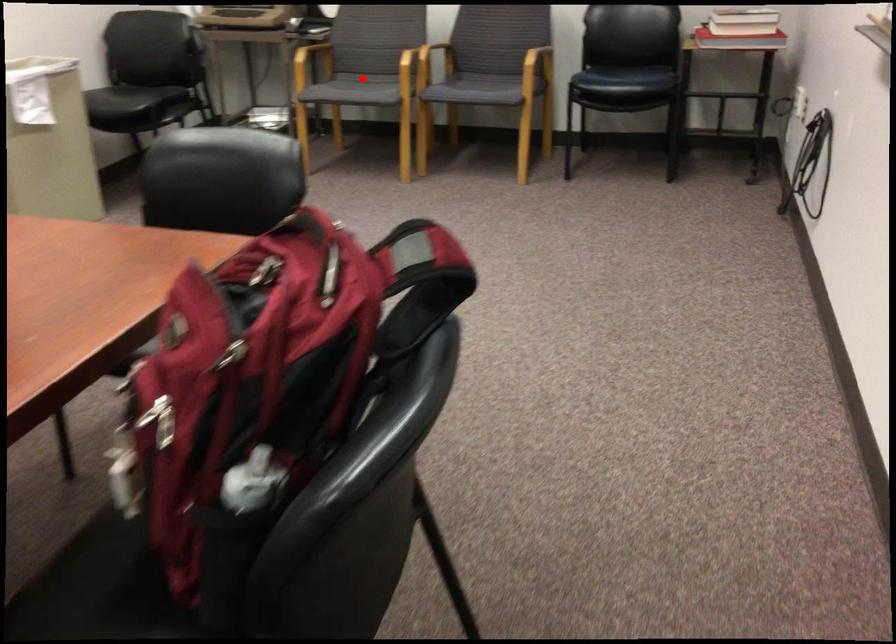
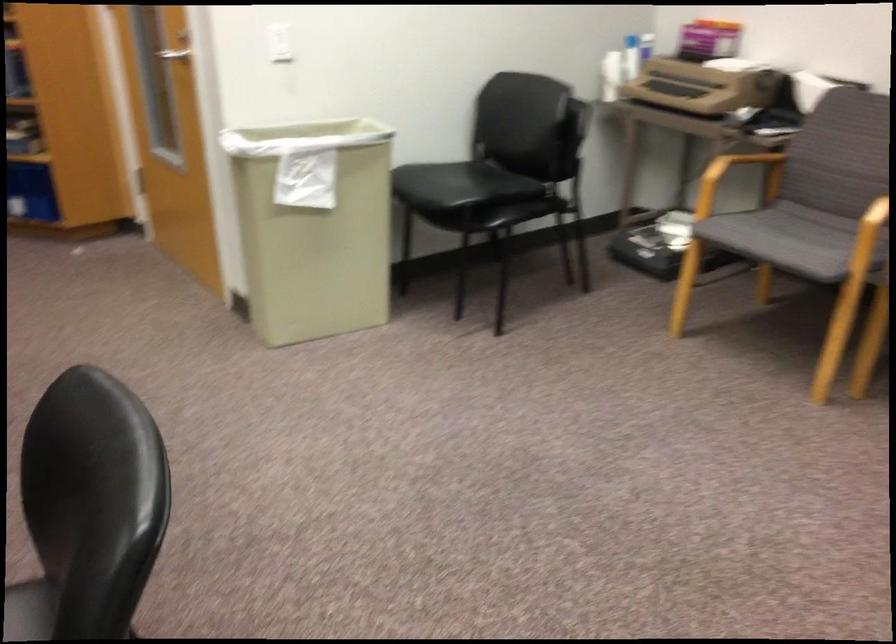
Question: I am providing you with two images of the same scene from different viewpoints. A red point is shown in image1. For the corresponding object point in image2, is it positioned nearer or farther from the camera?

Choices:
 (A) Nearer
 (B) Farther

Answer: (A)